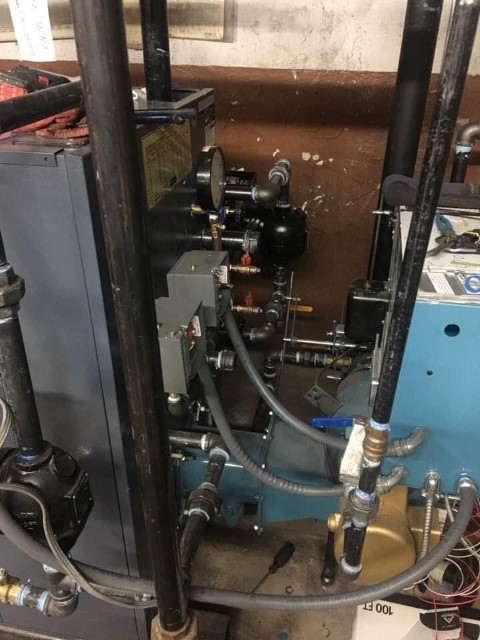
The image size is (480, 640). Identify the location of floor. (237, 570).